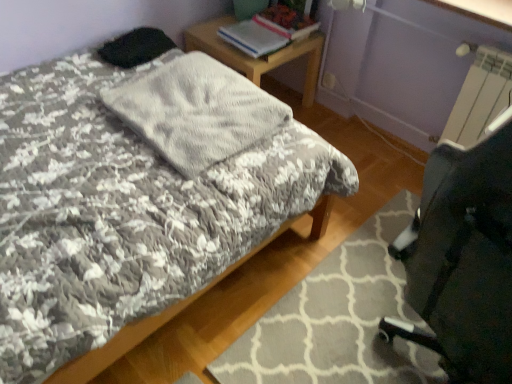
Question: Can you confirm if gray textured rug at lower right is bigger than hardcover book at upper center, the second book viewed from the right?

Choices:
 (A) yes
 (B) no

Answer: (A)

Question: Is gray textured rug at lower right wider than hardcover book at upper center, positioned as the 1th book in left-to-right order?

Choices:
 (A) yes
 (B) no

Answer: (A)

Question: Does gray textured rug at lower right have a smaller size compared to hardcover book at upper center, the second book viewed from the right?

Choices:
 (A) no
 (B) yes

Answer: (A)

Question: Is gray textured rug at lower right surrounding hardcover book at upper center, the second book viewed from the right?

Choices:
 (A) yes
 (B) no

Answer: (B)

Question: Is gray textured rug at lower right at the left side of hardcover book at upper center, the second book viewed from the right?

Choices:
 (A) yes
 (B) no

Answer: (B)

Question: From the image's perspective, relative to gray textured rug at lower right, is fluffy gray blanket at center above or below?

Choices:
 (A) above
 (B) below

Answer: (A)

Question: Does point (214, 82) appear closer or farther from the camera than point (231, 355)?

Choices:
 (A) closer
 (B) farther

Answer: (B)

Question: Is fluffy gray blanket at center wider or thinner than gray textured rug at lower right?

Choices:
 (A) wide
 (B) thin

Answer: (B)

Question: Visually, is fluffy gray blanket at center positioned to the left or to the right of gray textured rug at lower right?

Choices:
 (A) left
 (B) right

Answer: (A)

Question: In terms of height, does wooden desk at upper center look taller or shorter compared to hardcover book at upper center, which appears as the first book when viewed from the right?

Choices:
 (A) short
 (B) tall

Answer: (B)

Question: Does point (221, 41) appear closer or farther from the camera than point (311, 26)?

Choices:
 (A) closer
 (B) farther

Answer: (A)

Question: Based on their positions, is wooden desk at upper center located to the left or right of hardcover book at upper center, the second book in the left-to-right sequence?

Choices:
 (A) right
 (B) left

Answer: (B)

Question: From the image's perspective, is wooden desk at upper center above or below hardcover book at upper center, which appears as the first book when viewed from the right?

Choices:
 (A) below
 (B) above

Answer: (A)

Question: From a real-world perspective, is hardcover book at upper center, the second book viewed from the right, physically located above or below hardcover book at upper center, the second book in the left-to-right sequence?

Choices:
 (A) below
 (B) above

Answer: (A)

Question: In the image, is hardcover book at upper center, the second book viewed from the right, on the left side or the right side of hardcover book at upper center, the second book in the left-to-right sequence?

Choices:
 (A) right
 (B) left

Answer: (B)